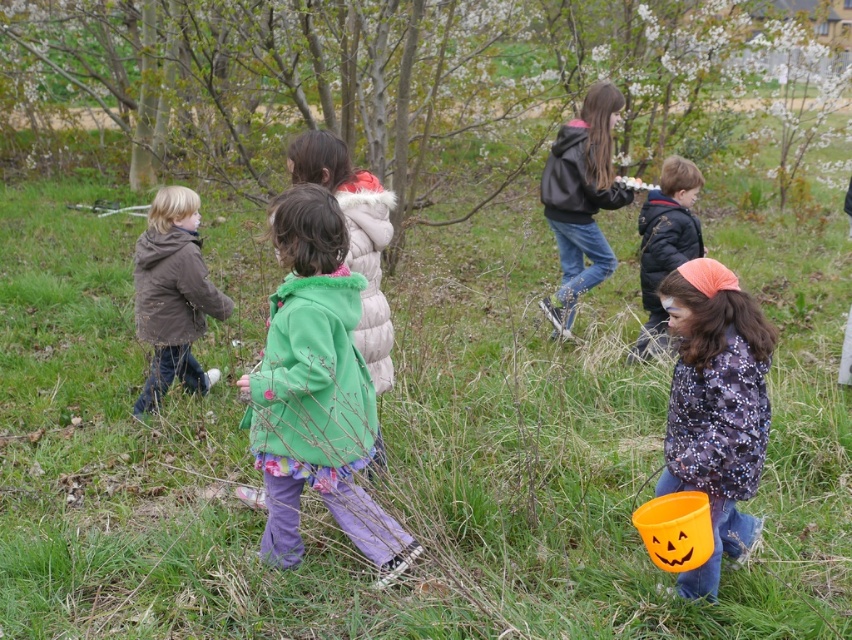
Question: Which point appears farthest from the camera in this image?

Choices:
 (A) (649, 307)
 (B) (154, 404)
 (C) (606, 147)
 (D) (301, 209)

Answer: (C)

Question: Which point appears closest to the camera in this image?

Choices:
 (A) (680, 173)
 (B) (769, 337)

Answer: (B)

Question: Is green fuzzy coat at center to the left of orange fabric bucket at lower right from the viewer's perspective?

Choices:
 (A) yes
 (B) no

Answer: (A)

Question: Considering the relative positions of brown matte jacket at left and matte black jacket at center in the image provided, where is brown matte jacket at left located with respect to matte black jacket at center?

Choices:
 (A) below
 (B) above

Answer: (A)

Question: Which of the following is the farthest from the observer?

Choices:
 (A) (177, 228)
 (B) (554, 189)

Answer: (B)

Question: Does brown matte jacket at left appear on the left side of dark blue jacket at center?

Choices:
 (A) no
 (B) yes

Answer: (B)